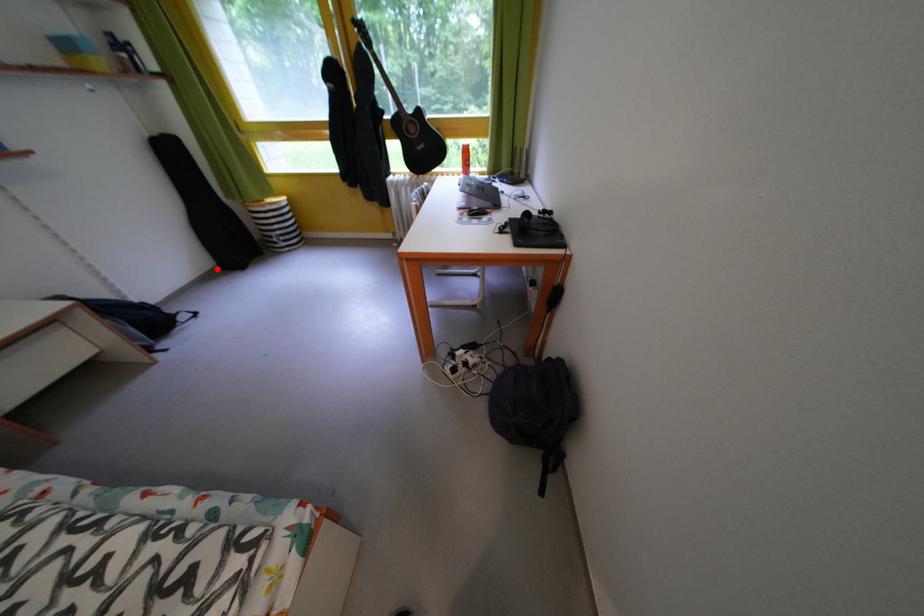
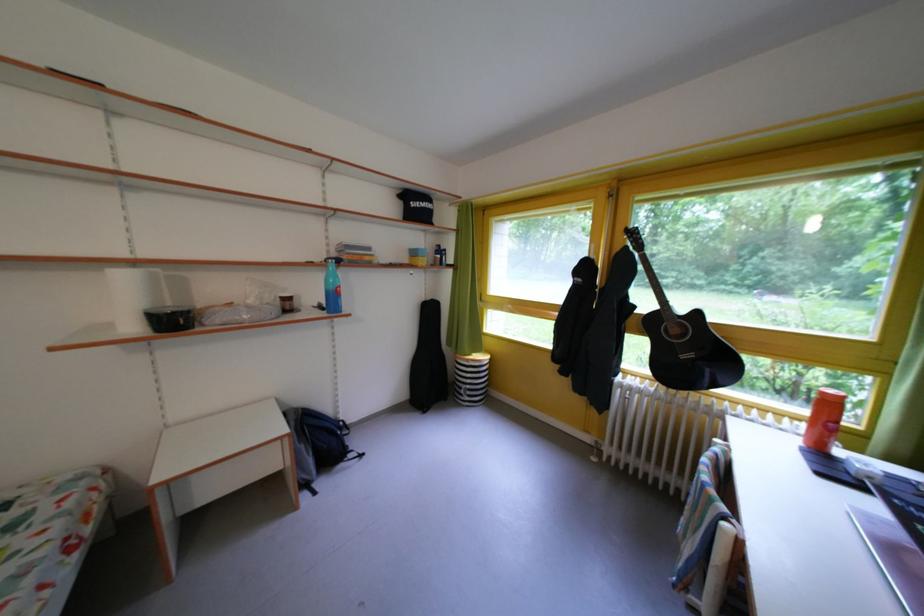
Question: I am providing you with two images of the same scene from different viewpoints. Given a red point in image1, look at the same physical point in image2. Is it:

Choices:
 (A) Closer to the viewpoint
 (B) Farther from the viewpoint

Answer: (B)